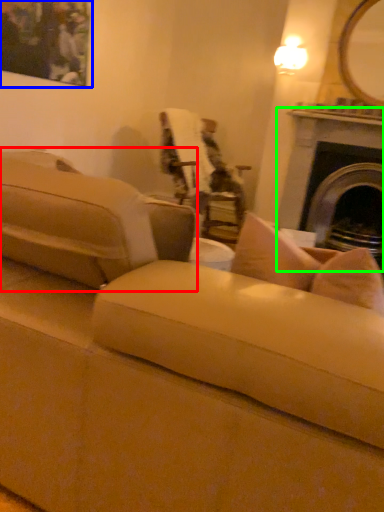
Question: Estimate the real-world distances between objects in this image. Which object is closer to studio couch (highlighted by a red box), picture frame (highlighted by a blue box) or fireplace (highlighted by a green box)?

Choices:
 (A) picture frame
 (B) fireplace

Answer: (A)